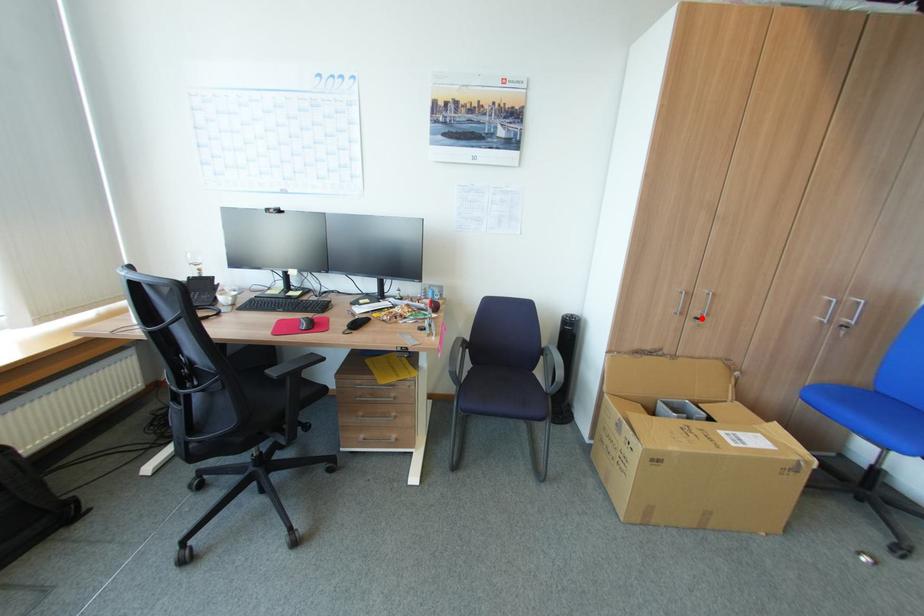
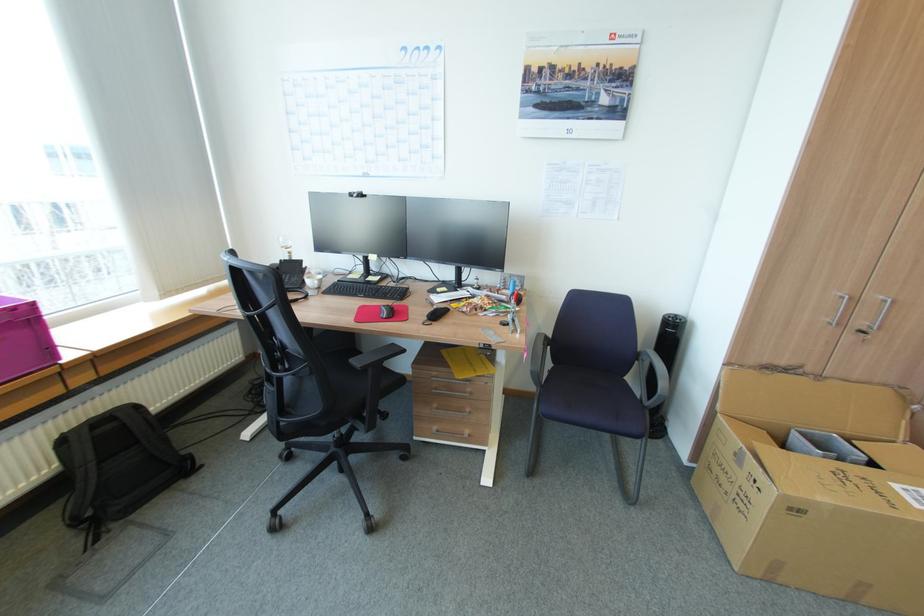
In the second image, find the point that corresponds to the highlighted location in the first image.

(868, 331)